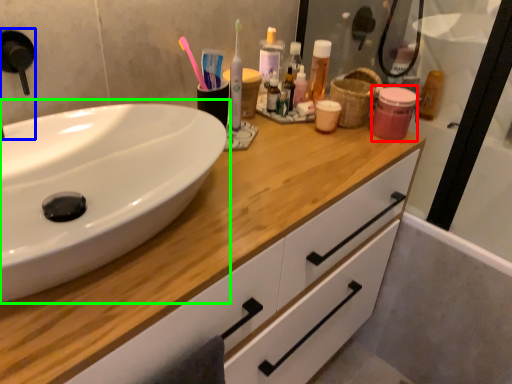
Question: Based on their relative distances, which object is farther from mouthwash (highlighted by a red box)? Choose from faucet (highlighted by a blue box) and sink (highlighted by a green box).

Choices:
 (A) faucet
 (B) sink

Answer: (A)